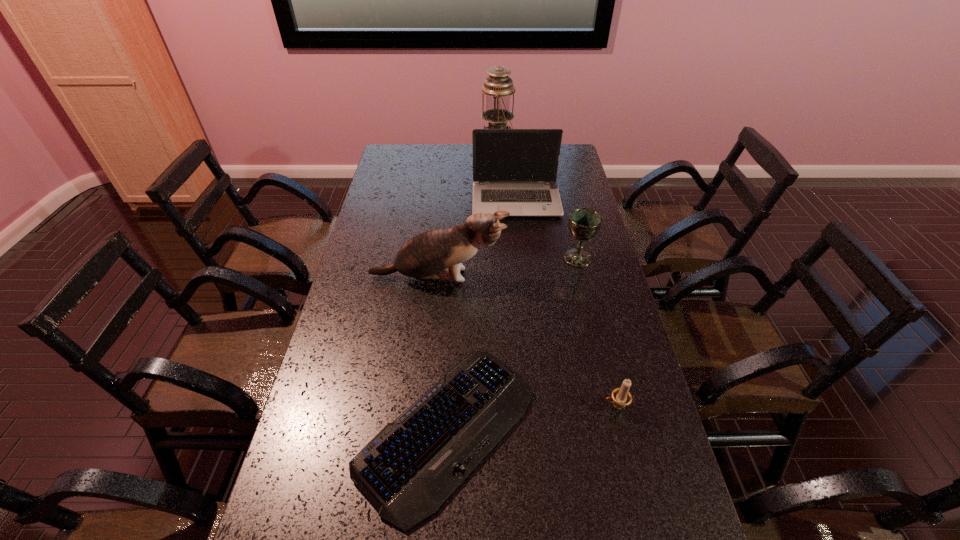
Image resolution: width=960 pixels, height=540 pixels. I want to click on vacant space located on the left of the chalice, so click(468, 258).

Where is `vacant space situated on the handle side of the second shortest object`? Image resolution: width=960 pixels, height=540 pixels. vacant space situated on the handle side of the second shortest object is located at coordinates (529, 406).

This screenshot has width=960, height=540. Find the location of `vacant space located 0.330m on the handle side of the second shortest object`. vacant space located 0.330m on the handle side of the second shortest object is located at coordinates (x=474, y=406).

I want to click on vacant space located on the handle side of the second shortest object, so click(x=450, y=406).

Where is `free location located 0.250m on the back of the computer keyboard`? This screenshot has height=540, width=960. free location located 0.250m on the back of the computer keyboard is located at coordinates (455, 291).

Locate an element on the screen. The height and width of the screenshot is (540, 960). object present at the far edge is located at coordinates [x=498, y=86].

This screenshot has height=540, width=960. Identify the location of cat at the left edge. (430, 255).

Where is `computer keyboard present at the left edge`? computer keyboard present at the left edge is located at coordinates (413, 465).

The width and height of the screenshot is (960, 540). Find the location of `laptop computer located at the right edge`. laptop computer located at the right edge is located at coordinates (515, 170).

Find the location of a particular element. This screenshot has height=540, width=960. chalice that is at the right edge is located at coordinates point(584,223).